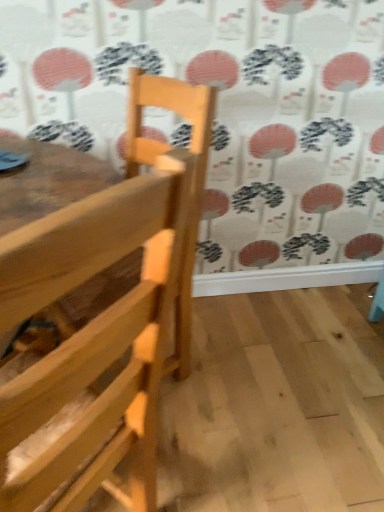
At what (x,y) coordinates should I click in order to perform the action: click on natural wood chair at center. Please return your answer as a coordinate pair (x, y). This screenshot has height=512, width=384. Looking at the image, I should click on point(107,311).

This screenshot has height=512, width=384. Describe the element at coordinates (107, 311) in the screenshot. I see `natural wood chair at center` at that location.

Identify the location of natural wood chair at center. The width and height of the screenshot is (384, 512). (107, 311).